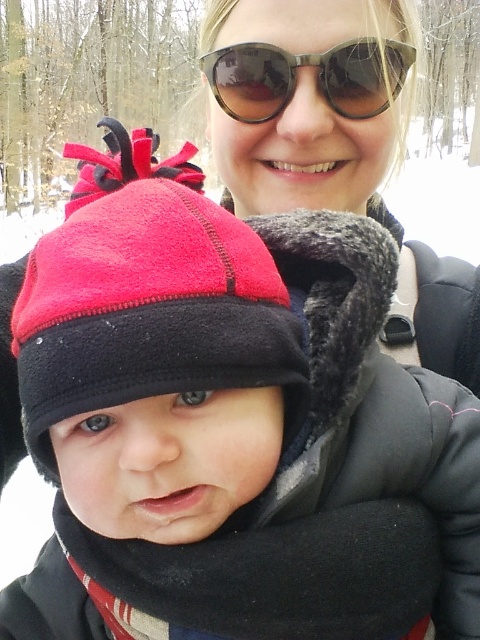
You are a photographer standing 20 inches away from the red fleece hat at center. Can you take a clear photo of it without moving closer?

The red fleece hat at center is 17.41 inches away from the viewer, so you are already 20 inches away, which is further than the hat. Therefore, you can take a clear photo without moving closer.

From the picture: You are a photographer trying to capture a clear shot of both the red fleece hat at center and the sunglasses at upper center. Since the two objects are in different positions, which one should you focus on first to ensure both are in focus?

The red fleece hat at center is positioned under sunglasses at upper center. To ensure both are in focus, focus on the sunglasses at upper center first, as it is closer to the camera, and the red fleece hat at center will fall into the depth of field.